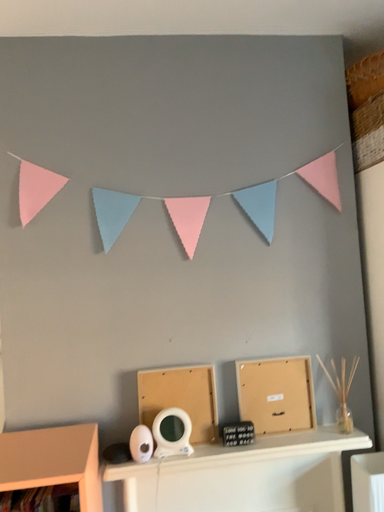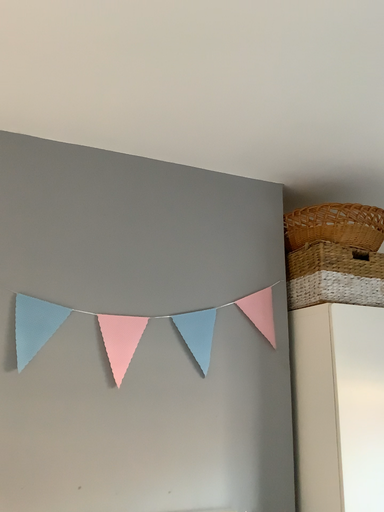
Question: Which way did the camera rotate in the video?

Choices:
 (A) rotated upward
 (B) rotated downward

Answer: (A)